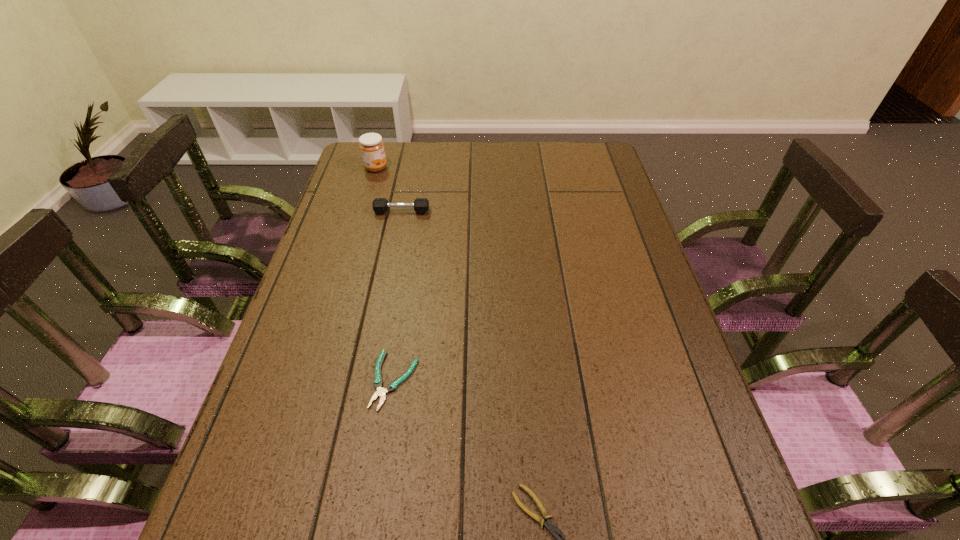
Locate an element on the screen. jam that is at the left edge is located at coordinates (371, 146).

At what (x,y) coordinates should I click in order to perform the action: click on dumbbell at the left edge. Please return your answer as a coordinate pair (x, y). The image size is (960, 540). Looking at the image, I should click on (380, 205).

Where is `object located in the far left corner section of the desktop`? This screenshot has width=960, height=540. object located in the far left corner section of the desktop is located at coordinates (371, 146).

The height and width of the screenshot is (540, 960). In the image, there is a desktop. In order to click on vacant region at the far edge in this screenshot , I will do `click(492, 146)`.

Identify the location of vacant area at the near edge. (399, 537).

The width and height of the screenshot is (960, 540). I want to click on vacant point at the left edge, so click(337, 295).

The image size is (960, 540). I want to click on free spot at the right edge of the desktop, so click(605, 219).

I want to click on vacant space at the far left corner of the desktop, so click(x=351, y=161).

This screenshot has height=540, width=960. In order to click on free spot at the far right corner of the desktop in this screenshot , I will do `click(569, 147)`.

Where is `empty location between the dumbbell and the third farthest object`? This screenshot has height=540, width=960. empty location between the dumbbell and the third farthest object is located at coordinates (398, 296).